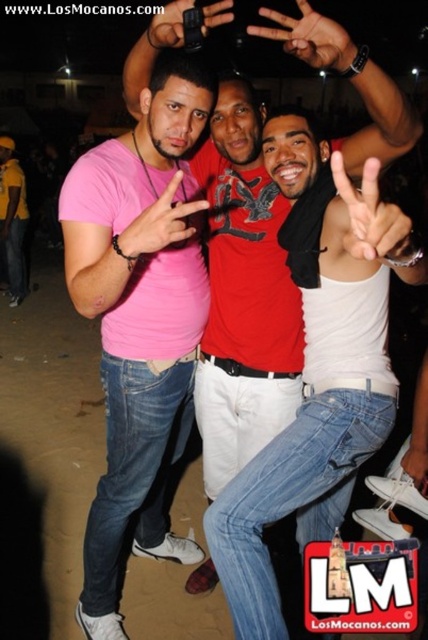
Question: Which point is farther to the camera?

Choices:
 (A) black matte hand at upper center
 (B) matte red shirt at center

Answer: (A)

Question: Does matte red shirt at center have a lesser width compared to black matte hand at upper center?

Choices:
 (A) no
 (B) yes

Answer: (A)

Question: Among these points, which one is nearest to the camera?

Choices:
 (A) (342, 38)
 (B) (177, 371)
 (C) (136, 240)

Answer: (A)

Question: Observing the image, what is the correct spatial positioning of white matte hand at center in reference to black matte hand at upper center?

Choices:
 (A) above
 (B) below

Answer: (B)

Question: Does pink matte shirt at center appear on the left side of matte black phone at upper center?

Choices:
 (A) yes
 (B) no

Answer: (A)

Question: Estimate the real-world distances between objects in this image. Which object is farther from the matte black phone at upper center?

Choices:
 (A) pink matte t-shirt at left
 (B) pink matte shirt at center
 (C) matte red shirt at center

Answer: (A)